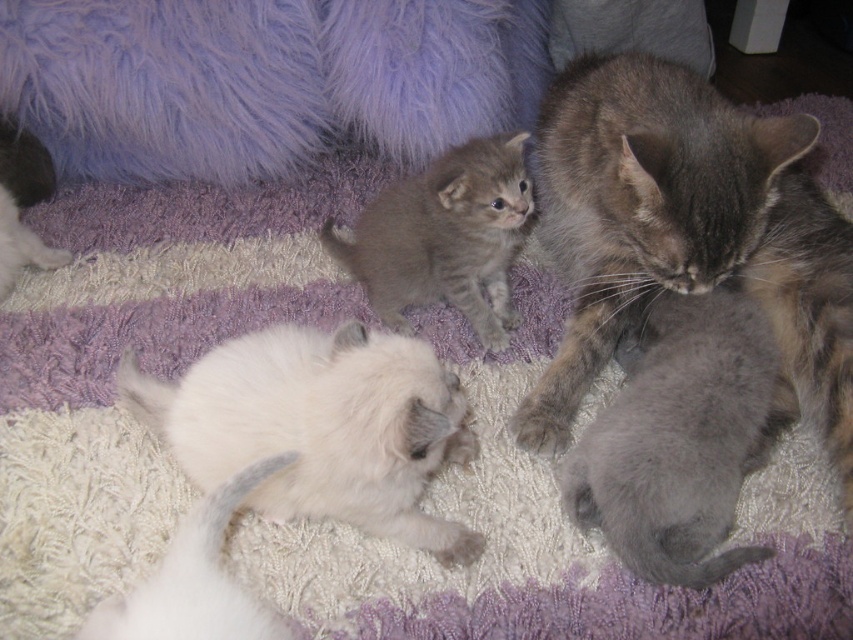
You are a photographer trying to capture a closeup of the soft gray kitten at lower right and the gray fluffy kitten at center. Since you want to focus on the smaller one, which kitten should you zoom in on?

The soft gray kitten at lower right has a lesser width compared to the gray fluffy kitten at center, so you should zoom in on the soft gray kitten at lower right to focus on the smaller one.

You are a cat owner trying to identify which of your kittens is the smallest. You have a soft gray kitten at lower right and a gray fluffy kitten at center. Which kitten is smaller?

The soft gray kitten at lower right is smaller than the gray fluffy kitten at center.

You are a cat owner observing the kittens in the image. You notice two specific points marked as point 1 and point 2. Point 1 is located at coordinates point [817,264] and point 2 is at point [32,179]. Which point is closer to the mother cat who is on the right side of the frame?

Point 2 at [32,179] is closer to the mother cat on the right side of the frame because it is behind point 1 at [817,264], which is further away from the mother cat.